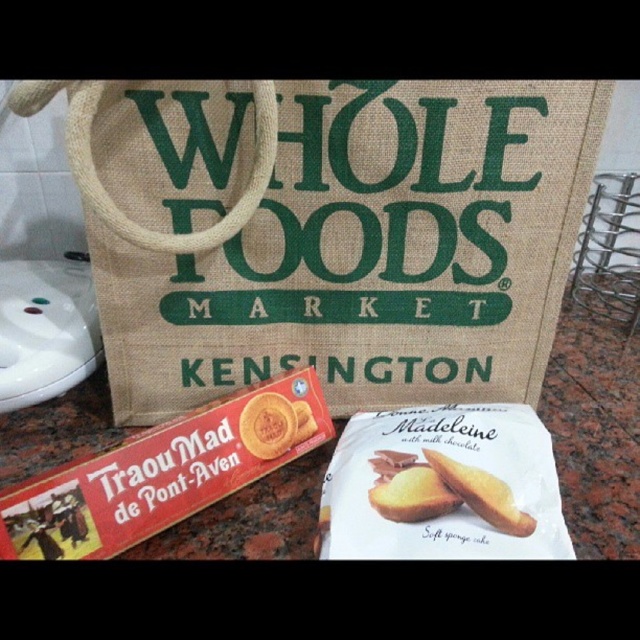
Question: Which object is positioned farthest from the white paper madeleine at center?

Choices:
 (A) golden brown cookie at center
 (B) golden matte cookie at center
 (C) burlap tote bag at center

Answer: (C)

Question: Does burlap tote bag at center have a larger size compared to red cardboard box of traou'mad de pont-aven cookies at lower left?

Choices:
 (A) yes
 (B) no

Answer: (A)

Question: Does burlap tote bag at center have a greater width compared to red cardboard box of traou'mad de pont-aven cookies at lower left?

Choices:
 (A) no
 (B) yes

Answer: (B)

Question: Which object is farther from the camera taking this photo?

Choices:
 (A) white paper madeleine at center
 (B) golden sponge cake at center
 (C) golden brown cookie at center
 (D) burlap tote bag at center

Answer: (C)

Question: Can you confirm if burlap tote bag at center is positioned below golden matte cookie at center?

Choices:
 (A) no
 (B) yes

Answer: (A)

Question: Which of these objects is positioned farthest from the golden matte cookie at center?

Choices:
 (A) burlap tote bag at center
 (B) golden brown cookie at center
 (C) golden sponge cake at center

Answer: (A)